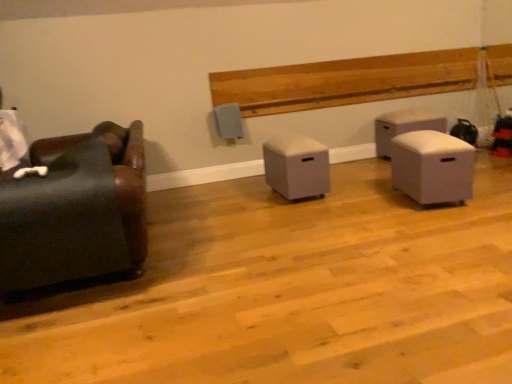
What do you see at coordinates (297, 167) in the screenshot? I see `beige fabric ottoman at center, the 3th furniture when ordered from right to left` at bounding box center [297, 167].

Find the location of a particular element. The image size is (512, 384). beige fabric ottoman at center, the second furniture in the left-to-right sequence is located at coordinates (297, 167).

At what (x,y) coordinates should I click in order to perform the action: click on white fabric ottoman at right, which is the 1th furniture from back to front. Please return your answer as a coordinate pair (x, y). This screenshot has width=512, height=384. Looking at the image, I should click on (404, 127).

Image resolution: width=512 pixels, height=384 pixels. What do you see at coordinates (432, 167) in the screenshot?
I see `white fabric ottoman at right, which ranks as the third furniture in back-to-front order` at bounding box center [432, 167].

What is the approximate height of white fabric ottoman at right, which is the 2th furniture in right-to-left order?

It is 21.14 inches.

Image resolution: width=512 pixels, height=384 pixels. I want to click on light brown wood paneling at upper center, so point(359,80).

I want to click on beige fabric ottoman at center, the second furniture in the left-to-right sequence, so click(x=297, y=167).

At what (x,y) coordinates should I click in order to perform the action: click on the 1st furniture positioned above the white fabric ottoman at right, which ranks as the third furniture in back-to-front order (from a real-world perspective). Please return your answer as a coordinate pair (x, y). Looking at the image, I should click on (297, 167).

Considering the sizes of objects white fabric ottoman at right, which ranks as the third furniture in back-to-front order, and beige fabric ottoman at center, which appears as the second furniture when viewed from the back, in the image provided, who is smaller, white fabric ottoman at right, which ranks as the third furniture in back-to-front order, or beige fabric ottoman at center, which appears as the second furniture when viewed from the back,?

beige fabric ottoman at center, which appears as the second furniture when viewed from the back.

Looking at this image, is white fabric ottoman at right, the second furniture positioned from the front, to the right of beige fabric ottoman at center, which appears as the second furniture when viewed from the back, from the viewer's perspective?

Correct, you'll find white fabric ottoman at right, the second furniture positioned from the front, to the right of beige fabric ottoman at center, which appears as the second furniture when viewed from the back.

Is point (411, 132) positioned before point (310, 194)?

No, it is behind (310, 194).

From the image's perspective, is white fabric ottoman at right, which is the 2th furniture in right-to-left order, positioned above or below light brown wood paneling at upper center?

From the image's perspective, white fabric ottoman at right, which is the 2th furniture in right-to-left order, appears below light brown wood paneling at upper center.

Based on the photo, can you confirm if white fabric ottoman at right, acting as the third furniture starting from the left, is positioned to the left of light brown wood paneling at upper center?

Incorrect, white fabric ottoman at right, acting as the third furniture starting from the left, is not on the left side of light brown wood paneling at upper center.

Is white fabric ottoman at right, which ranks as the third furniture in back-to-front order, smaller than light brown wood paneling at upper center?

Correct, white fabric ottoman at right, which ranks as the third furniture in back-to-front order, occupies less space than light brown wood paneling at upper center.

Is white fabric ottoman at right, the second furniture positioned from the front, completely or partially outside of light brown wood paneling at upper center?

Yes, white fabric ottoman at right, the second furniture positioned from the front, is outside of light brown wood paneling at upper center.

From the picture: In the image, is light brown wood paneling at upper center positioned in front of or behind beige fabric ottoman at center, the 3th furniture when ordered from right to left?

light brown wood paneling at upper center is behind beige fabric ottoman at center, the 3th furniture when ordered from right to left.

Is point (445, 67) closer to camera compared to point (267, 149)?

That is False.

In terms of width, does light brown wood paneling at upper center look wider or thinner when compared to beige fabric ottoman at center, which appears as the second furniture when viewed from the back?

In the image, light brown wood paneling at upper center appears to be more narrow than beige fabric ottoman at center, which appears as the second furniture when viewed from the back.

Would you say white fabric ottoman at right, the 1th furniture in the right-to-left sequence, is inside or outside light brown wood paneling at upper center?

white fabric ottoman at right, the 1th furniture in the right-to-left sequence, is not inside light brown wood paneling at upper center, it's outside.

From a real-world perspective, is white fabric ottoman at right, the 1th furniture in the right-to-left sequence, above or below light brown wood paneling at upper center?

Clearly, from a real-world perspective, white fabric ottoman at right, the 1th furniture in the right-to-left sequence, is below light brown wood paneling at upper center.

Looking at this image, is white fabric ottoman at right, which is the 1th furniture from back to front, directly adjacent to light brown wood paneling at upper center?

No, white fabric ottoman at right, which is the 1th furniture from back to front, is not making contact with light brown wood paneling at upper center.

Is leather couch at left, which appears as the fourth furniture when viewed from the back, directly adjacent to white fabric ottoman at right, which appears as the fourth furniture when viewed from the front?

No, leather couch at left, which appears as the fourth furniture when viewed from the back, is not in contact with white fabric ottoman at right, which appears as the fourth furniture when viewed from the front.

From a real-world perspective, is leather couch at left, which appears as the fourth furniture when viewed from the back, over white fabric ottoman at right, the 1th furniture in the right-to-left sequence?

Yes, from a real-world perspective, leather couch at left, which appears as the fourth furniture when viewed from the back, is above white fabric ottoman at right, the 1th furniture in the right-to-left sequence.

Is leather couch at left, which appears as the fourth furniture when viewed from the back, facing towards white fabric ottoman at right, the fourth furniture positioned from the left?

No, leather couch at left, which appears as the fourth furniture when viewed from the back, is not turned towards white fabric ottoman at right, the fourth furniture positioned from the left.

Is white fabric ottoman at right, which appears as the fourth furniture when viewed from the front, a part of leather couch at left, arranged as the first furniture when viewed from the front?

No, white fabric ottoman at right, which appears as the fourth furniture when viewed from the front, is not inside leather couch at left, arranged as the first furniture when viewed from the front.

Is the surface of beige fabric ottoman at center, the 3th furniture when ordered from right to left, in direct contact with leather couch at left, which appears as the fourth furniture when viewed from the back?

beige fabric ottoman at center, the 3th furniture when ordered from right to left, and leather couch at left, which appears as the fourth furniture when viewed from the back, are clearly separated.

Is point (270, 141) positioned behind point (96, 152)?

That is True.

From the image's perspective, between beige fabric ottoman at center, which appears as the second furniture when viewed from the back, and leather couch at left, arranged as the first furniture when viewed from the front, which one is located above?

beige fabric ottoman at center, which appears as the second furniture when viewed from the back, appears higher in the image.

Is point (380, 60) closer or farther from the camera than point (452, 167)?

Point (380, 60) appears to be farther away from the viewer than point (452, 167).

Considering the sizes of objects light brown wood paneling at upper center and white fabric ottoman at right, the second furniture positioned from the front, in the image provided, who is thinner, light brown wood paneling at upper center or white fabric ottoman at right, the second furniture positioned from the front,?

light brown wood paneling at upper center.

Which is more to the left, light brown wood paneling at upper center or white fabric ottoman at right, the second furniture positioned from the front?

From the viewer's perspective, light brown wood paneling at upper center appears more on the left side.

Is light brown wood paneling at upper center oriented away from white fabric ottoman at right, which is the 2th furniture in right-to-left order?

No, light brown wood paneling at upper center is not facing the opposite direction of white fabric ottoman at right, which is the 2th furniture in right-to-left order.

Find the location of a particular element. This screenshot has height=384, width=512. the 1st furniture behind the white fabric ottoman at right, the second furniture positioned from the front, counting from the anchor's position is located at coordinates (297, 167).

Where is `hardwood on the left of white fabric ottoman at right, acting as the third furniture starting from the left`? The height and width of the screenshot is (384, 512). hardwood on the left of white fabric ottoman at right, acting as the third furniture starting from the left is located at coordinates (359, 80).

Looking at the image, which one is located further to white fabric ottoman at right, which ranks as the third furniture in back-to-front order, leather couch at left, arranged as the first furniture when viewed from the front, or white fabric ottoman at right, the 1th furniture in the right-to-left sequence?

The object further to white fabric ottoman at right, which ranks as the third furniture in back-to-front order, is leather couch at left, arranged as the first furniture when viewed from the front.

When comparing their distances from white fabric ottoman at right, acting as the third furniture starting from the left, does beige fabric ottoman at center, which is the third furniture in front-to-back order, or white fabric ottoman at right, the fourth furniture positioned from the left, seem closer?

Based on the image, beige fabric ottoman at center, which is the third furniture in front-to-back order, appears to be nearer to white fabric ottoman at right, acting as the third furniture starting from the left.

Based on their spatial positions, is white fabric ottoman at right, acting as the third furniture starting from the left, or light brown wood paneling at upper center further from white fabric ottoman at right, which appears as the fourth furniture when viewed from the front?

Based on the image, white fabric ottoman at right, acting as the third furniture starting from the left, appears to be further to white fabric ottoman at right, which appears as the fourth furniture when viewed from the front.

When comparing their distances from light brown wood paneling at upper center, does white fabric ottoman at right, the second furniture positioned from the front, or leather couch at left, arranged as the first furniture when viewed from the front, seem closer?

white fabric ottoman at right, the second furniture positioned from the front, is positioned closer to the anchor light brown wood paneling at upper center.

Looking at the image, which one is located closer to white fabric ottoman at right, which is the 2th furniture in right-to-left order, light brown wood paneling at upper center or beige fabric ottoman at center, the second furniture in the left-to-right sequence?

beige fabric ottoman at center, the second furniture in the left-to-right sequence.

Considering their positions, is white fabric ottoman at right, which is the 2th furniture in right-to-left order, positioned closer to beige fabric ottoman at center, which appears as the second furniture when viewed from the back, than light brown wood paneling at upper center?

white fabric ottoman at right, which is the 2th furniture in right-to-left order, lies closer to beige fabric ottoman at center, which appears as the second furniture when viewed from the back, than the other object.

When comparing their distances from white fabric ottoman at right, the 1th furniture in the right-to-left sequence, does leather couch at left, which appears as the fourth furniture when viewed from the back, or light brown wood paneling at upper center seem further?

leather couch at left, which appears as the fourth furniture when viewed from the back, lies further to white fabric ottoman at right, the 1th furniture in the right-to-left sequence, than the other object.

Considering their positions, is beige fabric ottoman at center, which appears as the second furniture when viewed from the back, positioned closer to light brown wood paneling at upper center than leather couch at left, the 4th furniture viewed from the right?

beige fabric ottoman at center, which appears as the second furniture when viewed from the back, lies closer to light brown wood paneling at upper center than the other object.

This screenshot has width=512, height=384. I want to click on furniture between leather couch at left, arranged as the first furniture when viewed from the front, and white fabric ottoman at right, which ranks as the third furniture in back-to-front order, so click(x=297, y=167).

Identify the location of hardwood between white fabric ottoman at right, which is the 2th furniture in right-to-left order, and white fabric ottoman at right, which appears as the fourth furniture when viewed from the front, in the front-back direction. This screenshot has width=512, height=384. (359, 80).

Find the location of `hardwood located between leather couch at left, arranged as the first furniture when viewed from the front, and white fabric ottoman at right, which appears as the fourth furniture when viewed from the front, in the left-right direction`. hardwood located between leather couch at left, arranged as the first furniture when viewed from the front, and white fabric ottoman at right, which appears as the fourth furniture when viewed from the front, in the left-right direction is located at coordinates (359, 80).

This screenshot has height=384, width=512. Identify the location of hardwood between leather couch at left, which is the first furniture in left-to-right order, and white fabric ottoman at right, acting as the third furniture starting from the left, from left to right. click(359, 80).